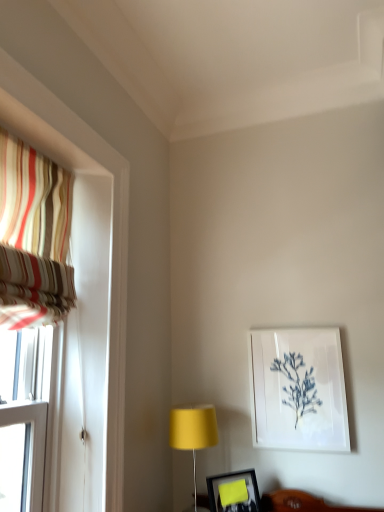
Question: In the image, is striped fabric curtain at left positioned in front of or behind matte black picture frame at lower center, the 1th picture frame from the bottom?

Choices:
 (A) behind
 (B) front

Answer: (B)

Question: From a real-world perspective, is striped fabric curtain at left above or below matte black picture frame at lower center, the 1th picture frame from the bottom?

Choices:
 (A) above
 (B) below

Answer: (A)

Question: Which is farther from the matte yellow lampshade at center?

Choices:
 (A) striped fabric curtain at left
 (B) white paper at upper right, which ranks as the second picture frame in left-to-right order
 (C) matte black picture frame at lower center, the 1th picture frame from the bottom

Answer: (A)

Question: Which is nearer to the matte black picture frame at lower center, the 1th picture frame from the bottom?

Choices:
 (A) striped fabric curtain at left
 (B) matte yellow lampshade at center
 (C) white paper at upper right, the first picture frame from the back

Answer: (B)